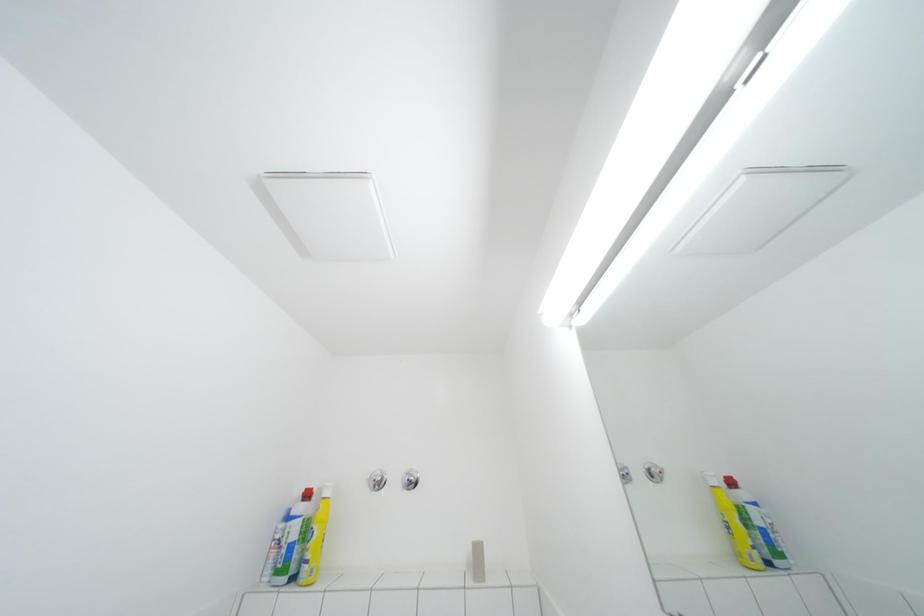
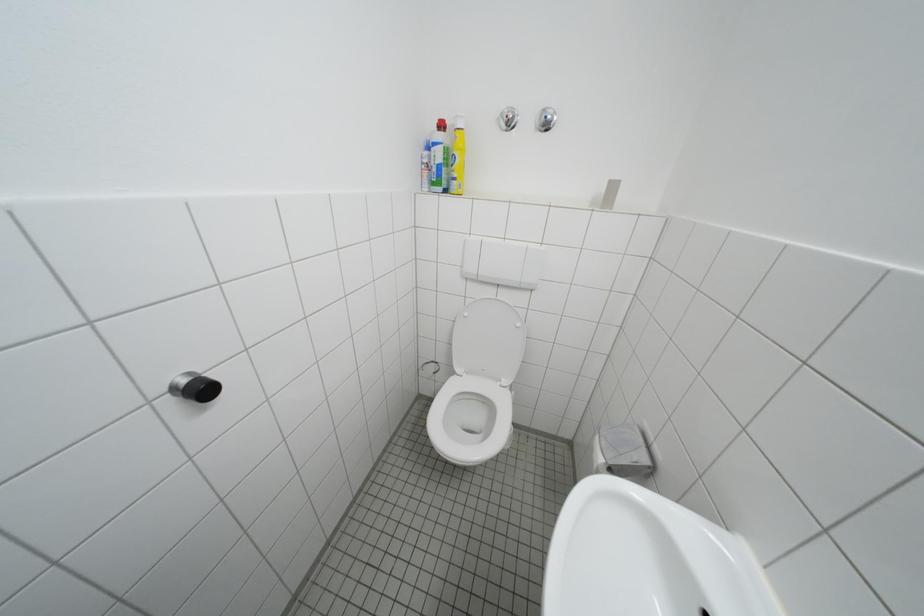
The images are taken continuously from a first-person perspective. In which direction is your viewpoint rotating?

The camera rotated toward left-down.